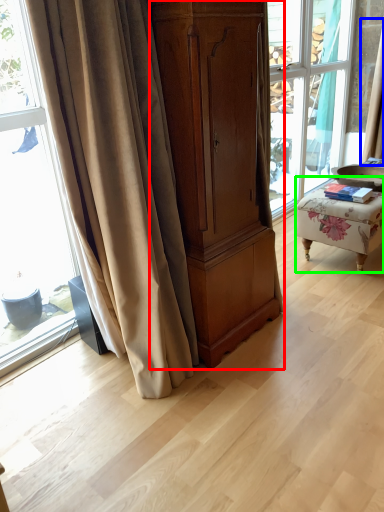
Question: Which object is the closest to the cabinetry (highlighted by a red box)? Choose among these: curtain (highlighted by a blue box) or furniture (highlighted by a green box).

Choices:
 (A) curtain
 (B) furniture

Answer: (B)